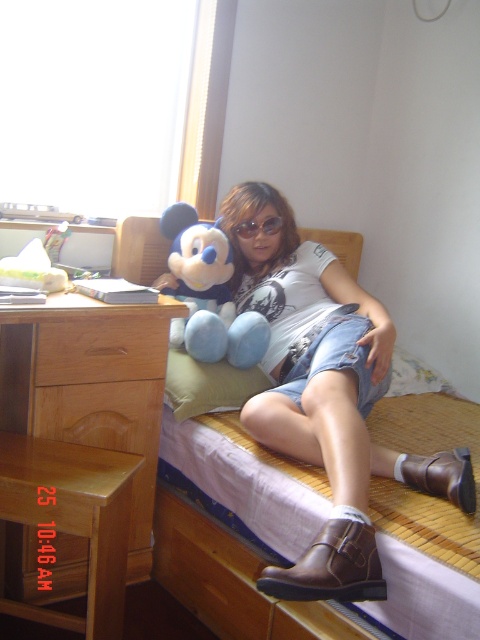
Consider the image. Does denim shorts at center appear on the left side of black plastic goggles at center?

In fact, denim shorts at center is to the right of black plastic goggles at center.

Find the location of `denim shorts at center`. denim shorts at center is located at coordinates (325, 396).

Is the position of denim shorts at center less distant than that of blue plush toy at center?

Yes, denim shorts at center is in front of blue plush toy at center.

I want to click on denim shorts at center, so click(x=325, y=396).

You are a GUI agent. You are given a task and a screenshot of the screen. Output one action in this format:
    pyautogui.click(x=<x>, y=<y>)
    Task: Click on the denim shorts at center
    This screenshot has height=640, width=480.
    Given the screenshot: What is the action you would take?
    pyautogui.click(x=325, y=396)

This screenshot has width=480, height=640. I want to click on denim shorts at center, so click(x=325, y=396).

Between blue plush toy at center and black plastic goggles at center, which one appears on the left side from the viewer's perspective?

blue plush toy at center

Find the location of a particular element. blue plush toy at center is located at coordinates (208, 292).